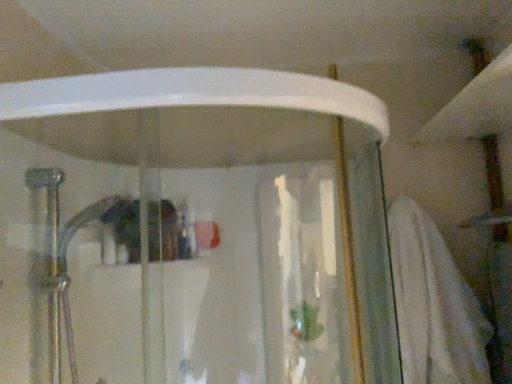
Question: Is white soft towel at right placed right next to transparent glass shower door at center?

Choices:
 (A) yes
 (B) no

Answer: (B)

Question: Can you confirm if white soft towel at right is shorter than transparent glass shower door at center?

Choices:
 (A) no
 (B) yes

Answer: (B)

Question: Does white soft towel at right have a greater height compared to transparent glass shower door at center?

Choices:
 (A) no
 (B) yes

Answer: (A)

Question: Is white soft towel at right smaller than transparent glass shower door at center?

Choices:
 (A) yes
 (B) no

Answer: (A)

Question: Considering the relative positions of white soft towel at right and transparent glass shower door at center in the image provided, is white soft towel at right in front of transparent glass shower door at center?

Choices:
 (A) yes
 (B) no

Answer: (B)

Question: From a real-world perspective, is white soft towel at right below transparent glass shower door at center?

Choices:
 (A) yes
 (B) no

Answer: (A)

Question: Is transparent glass shower door at center behind white soft towel at right?

Choices:
 (A) no
 (B) yes

Answer: (A)

Question: From a real-world perspective, is transparent glass shower door at center on white soft towel at right?

Choices:
 (A) no
 (B) yes

Answer: (B)

Question: Is transparent glass shower door at center turned away from white soft towel at right?

Choices:
 (A) no
 (B) yes

Answer: (A)

Question: Considering the relative sizes of transparent glass shower door at center and white soft towel at right in the image provided, is transparent glass shower door at center taller than white soft towel at right?

Choices:
 (A) no
 (B) yes

Answer: (B)

Question: Would you say transparent glass shower door at center contains white soft towel at right?

Choices:
 (A) yes
 (B) no

Answer: (B)

Question: Is transparent glass shower door at center touching white soft towel at right?

Choices:
 (A) yes
 (B) no

Answer: (B)

Question: Based on their sizes in the image, would you say white soft towel at right is bigger or smaller than transparent glass shower door at center?

Choices:
 (A) big
 (B) small

Answer: (B)